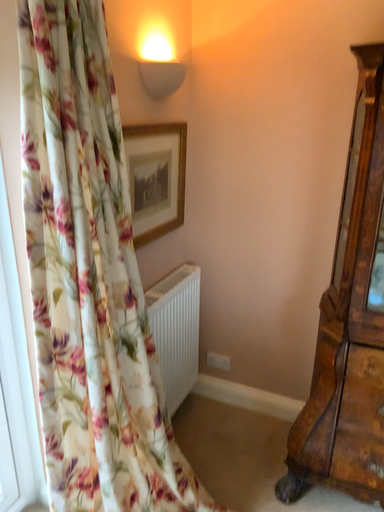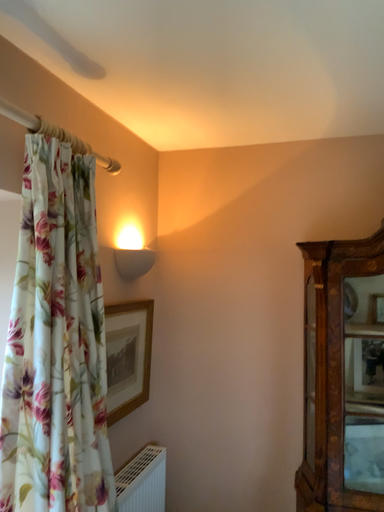
Question: How did the camera likely rotate when shooting the video?

Choices:
 (A) rotated left
 (B) rotated right

Answer: (B)